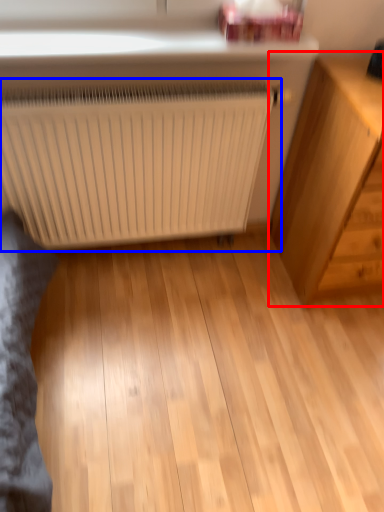
Question: Among these objects, which one is farthest to the camera, chest of drawers (highlighted by a red box) or radiator (highlighted by a blue box)?

Choices:
 (A) chest of drawers
 (B) radiator

Answer: (B)